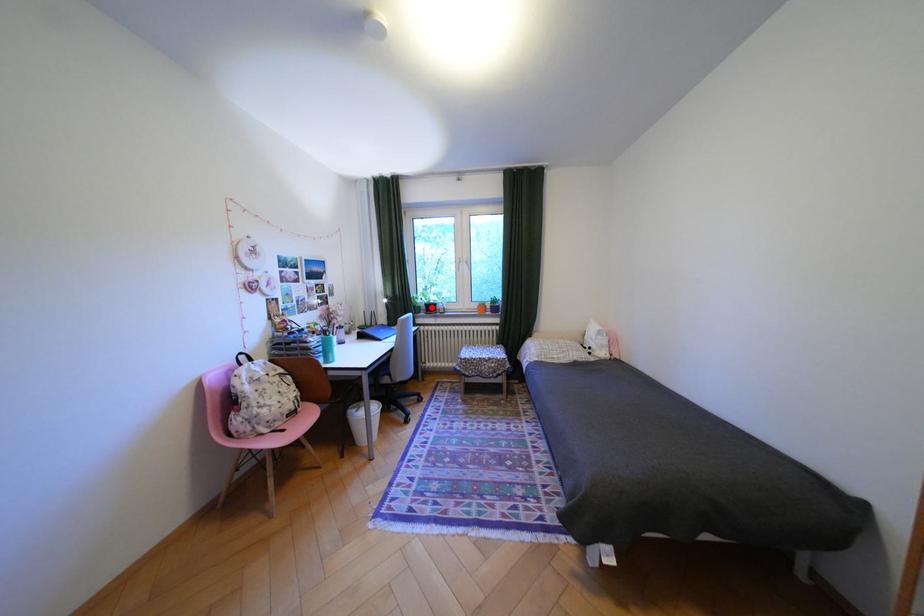
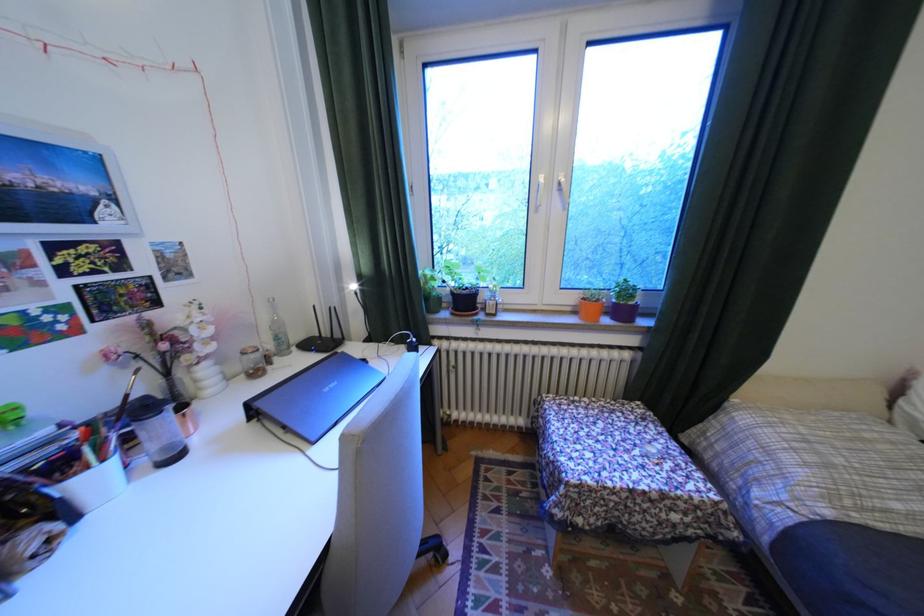
The point at the highlighted location is marked in the first image. Where is the corresponding point in the second image?

(451, 299)